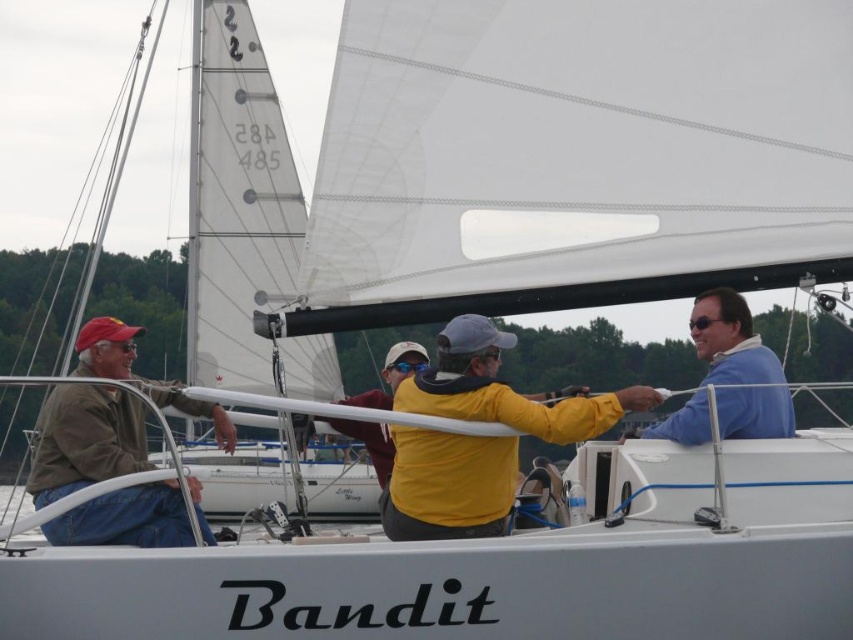
Who is positioned more to the right, yellow matte jacket at center or brown leather jacket at left?

From the viewer's perspective, yellow matte jacket at center appears more on the right side.

What do you see at coordinates (505, 388) in the screenshot? The image size is (853, 640). I see `yellow matte jacket at center` at bounding box center [505, 388].

At what (x,y) coordinates should I click in order to perform the action: click on yellow matte jacket at center. Please return your answer as a coordinate pair (x, y). The height and width of the screenshot is (640, 853). Looking at the image, I should click on (505, 388).

Which of these two, yellow matte jacket at center or blue smooth shirt at upper right, stands taller?

With more height is blue smooth shirt at upper right.

Does yellow matte jacket at center have a greater width compared to blue smooth shirt at upper right?

Yes, yellow matte jacket at center is wider than blue smooth shirt at upper right.

I want to click on yellow matte jacket at center, so click(505, 388).

Who is positioned more to the right, brown leather jacket at left or blue smooth shirt at upper right?

From the viewer's perspective, blue smooth shirt at upper right appears more on the right side.

Is brown leather jacket at left thinner than blue smooth shirt at upper right?

Incorrect, brown leather jacket at left's width is not less than blue smooth shirt at upper right's.

Locate an element on the screen. The image size is (853, 640). brown leather jacket at left is located at coordinates (86, 440).